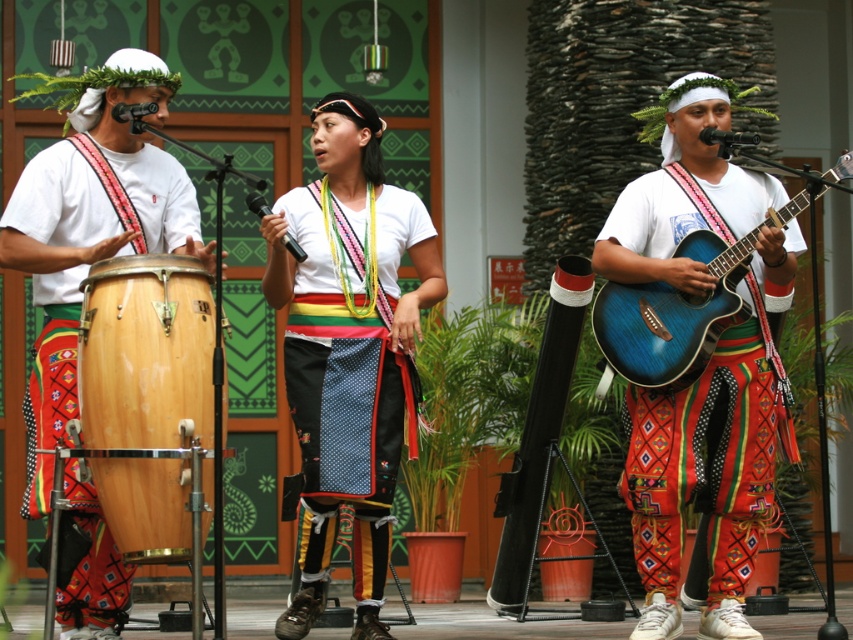
You are a stagehand setting up the performance area. You need to place the matte wood drum at left and the blue wood guitar at right on a shelf that can only hold items up to 1 meter in length. Given their sizes, will both fit on the shelf?

The matte wood drum at left has a smaller size compared to blue wood guitar at right. However, without specific measurements, it is impossible to determine if both will fit on the shelf. Please provide exact dimensions for accurate assessment.

You are a stagehand setting up equipment for the performance. You need to place a tall stand for the natural wood drum at left and a shorter stand for the blue wood guitar at right. Which stand should you place closer to the front of the stage to ensure both instruments are visible to the audience?

The natural wood drum at left is much taller than the blue wood guitar at right, so you should place the taller stand for the natural wood drum at left closer to the front of the stage. This way, both instruments will be visible, with the taller drum not blocking the view of the shorter guitar.